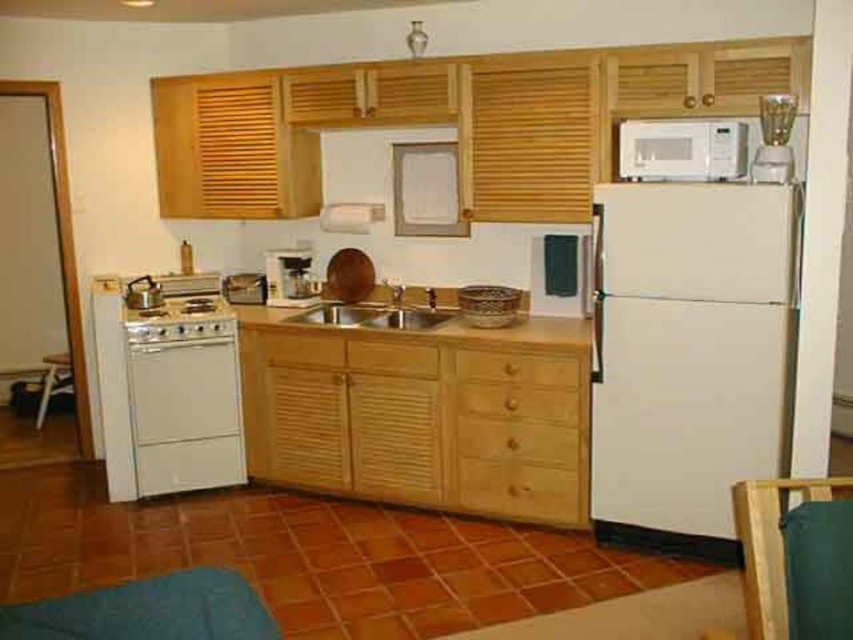
Question: Is light wood drawer at center below wooden stool at lower left?

Choices:
 (A) no
 (B) yes

Answer: (B)

Question: Is wooden at center to the right of wooden stool at lower left from the viewer's perspective?

Choices:
 (A) no
 (B) yes

Answer: (B)

Question: Which object is the farthest from the metallic sink at center?

Choices:
 (A) wooden stool at lower left
 (B) wooden at center
 (C) matte black coffee maker at center
 (D) brushed metal coffee maker at center

Answer: (A)

Question: Which object is farther from the camera taking this photo?

Choices:
 (A) wooden drawer at center
 (B) matte black coffee maker at center

Answer: (B)

Question: Estimate the real-world distances between objects in this image. Which object is closer to the wooden at center?

Choices:
 (A) white matte refrigerator at right
 (B) light wood drawer at center

Answer: (B)

Question: Is metallic sink at center wider than wooden stool at lower left?

Choices:
 (A) yes
 (B) no

Answer: (A)